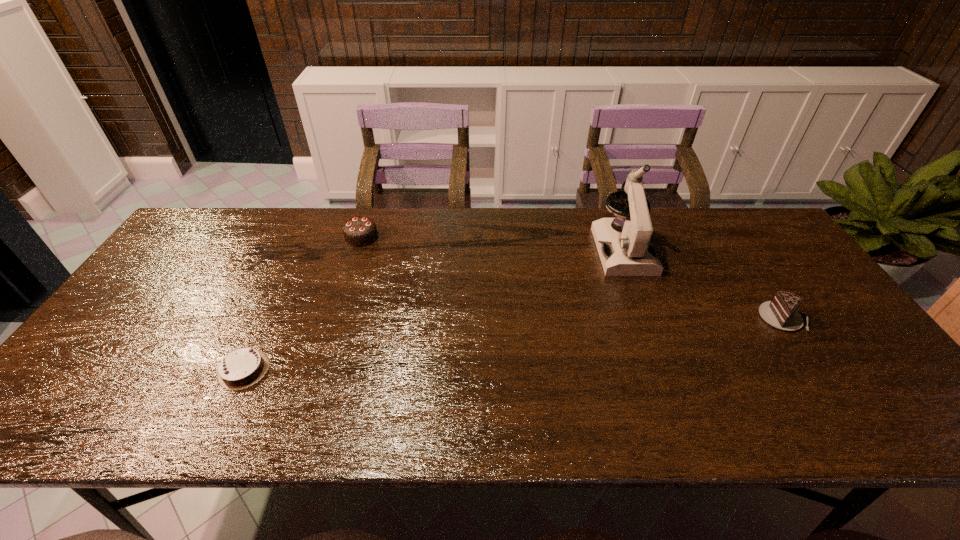
Locate which object ranks in proximity to the tallest chocolate cake. Please provide its 2D coordinates. Your answer should be formatted as a tuple, i.e. [(x, y)], where the tuple contains the x and y coordinates of a point satisfying the conditions above.

[(243, 367)]

Identify which chocolate cake is the second closest to the second object from left to right. Please provide its 2D coordinates. Your answer should be formatted as a tuple, i.e. [(x, y)], where the tuple contains the x and y coordinates of a point satisfying the conditions above.

[(781, 313)]

Locate an element on the screen. Image resolution: width=960 pixels, height=540 pixels. the closest chocolate cake relative to the nearest object is located at coordinates (360, 231).

Identify the location of vacant space that satisfies the following two spatial constraints: 1. on the back side of the leftmost object; 2. on the right side of the second chocolate cake from right to left. Image resolution: width=960 pixels, height=540 pixels. (306, 237).

This screenshot has width=960, height=540. Identify the location of free space that satisfies the following two spatial constraints: 1. at the eyepiece of the microscope; 2. on the left side of the rightmost object. (648, 318).

The width and height of the screenshot is (960, 540). Identify the location of vacant space that satisfies the following two spatial constraints: 1. at the eyepiece of the rightmost object; 2. on the left side of the second object from right to left. (648, 318).

The image size is (960, 540). I want to click on blank space that satisfies the following two spatial constraints: 1. at the eyepiece of the tallest object; 2. on the left side of the second shortest chocolate cake, so click(648, 318).

Find the location of a particular element. This screenshot has width=960, height=540. vacant region that satisfies the following two spatial constraints: 1. at the eyepiece of the third object from left to right; 2. on the right side of the second shortest chocolate cake is located at coordinates (648, 318).